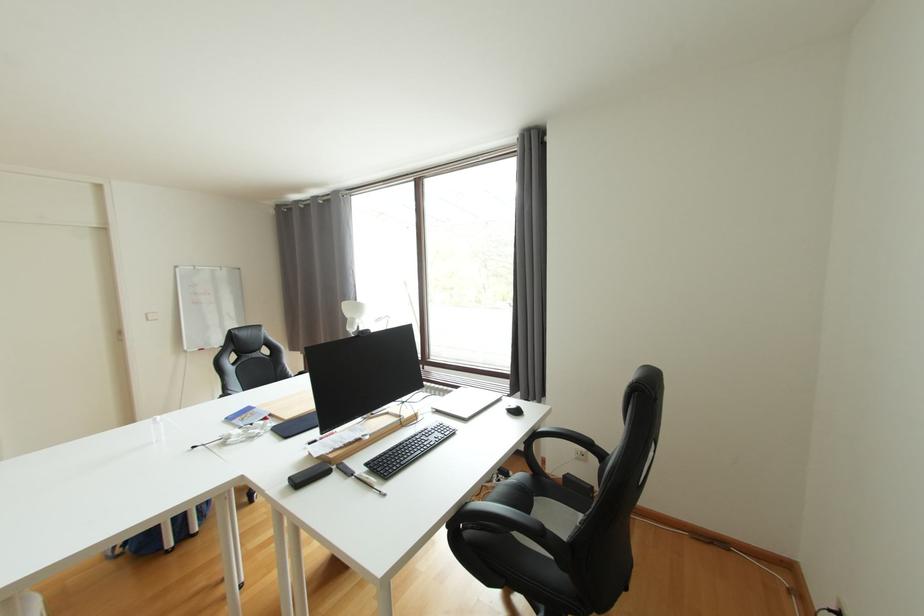
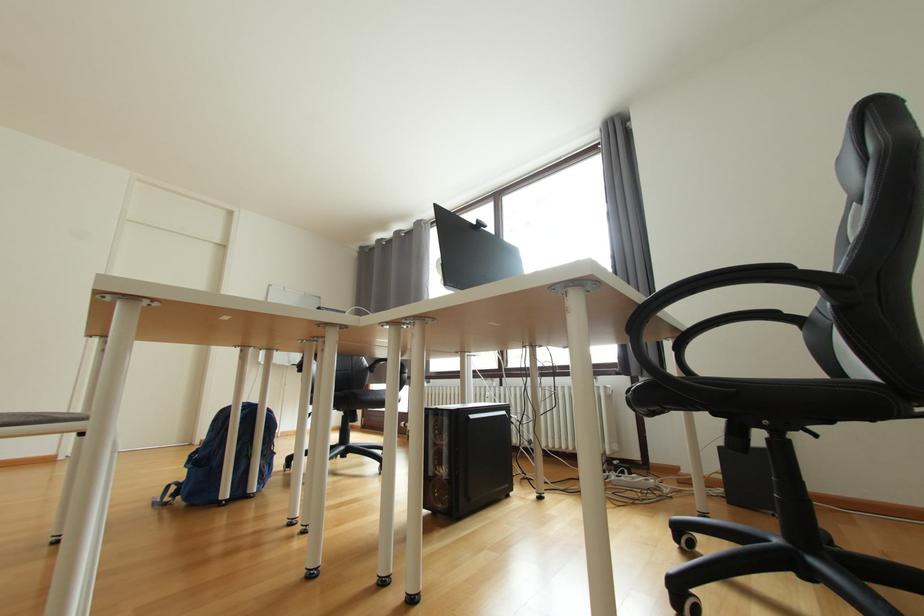
What movement of the cameraman would produce the second image?

The movement direction of the cameraman is left, forward.